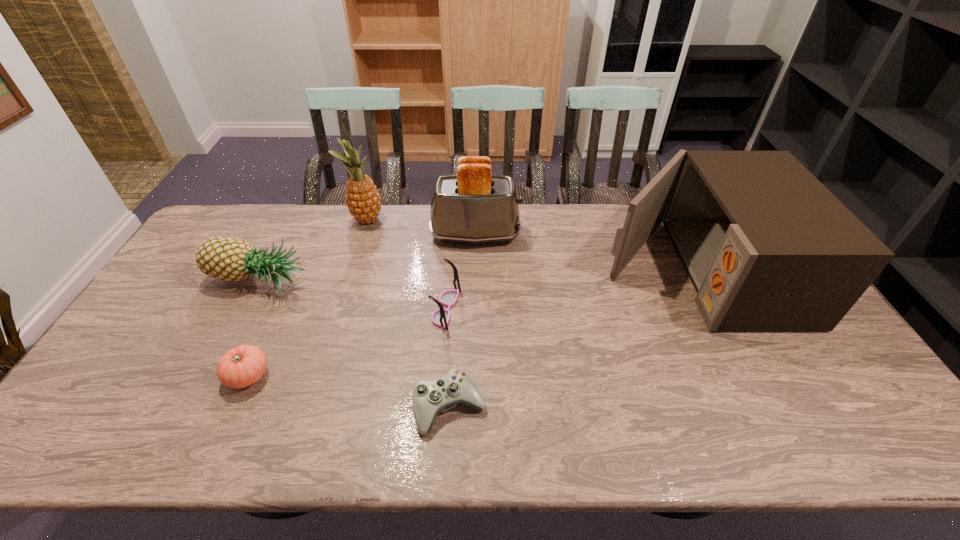
You are a GUI agent. You are given a task and a screenshot of the screen. Output one action in this format:
    pyautogui.click(x=<x>, y=<y>)
    Task: Click on the microwave oven that is at the far edge
    
    Given the screenshot: What is the action you would take?
    pyautogui.click(x=767, y=246)

Find the location of a particular element. object that is at the near edge is located at coordinates (430, 398).

This screenshot has width=960, height=540. I want to click on object present at the left edge, so click(x=231, y=259).

Locate an element on the screen. The height and width of the screenshot is (540, 960). object situated at the right edge is located at coordinates (767, 246).

Where is `object that is at the far right corner`? This screenshot has height=540, width=960. object that is at the far right corner is located at coordinates (767, 246).

The width and height of the screenshot is (960, 540). In the image, there is a desktop. In order to click on vacant space at the far edge in this screenshot , I will do `click(300, 218)`.

In order to click on blank space at the near edge in this screenshot , I will do (x=442, y=438).

Where is `vacant region at the near right corner of the desktop`? This screenshot has height=540, width=960. vacant region at the near right corner of the desktop is located at coordinates (899, 454).

At what (x,y) coordinates should I click in order to perform the action: click on free point between the left pineapple and the control. Please return your answer as a coordinate pair (x, y). This screenshot has height=540, width=960. Looking at the image, I should click on (354, 345).

At what (x,y) coordinates should I click in order to perform the action: click on free point between the sixth tallest object and the shortest object. Please return your answer as a coordinate pair (x, y). The height and width of the screenshot is (540, 960). Looking at the image, I should click on (349, 392).